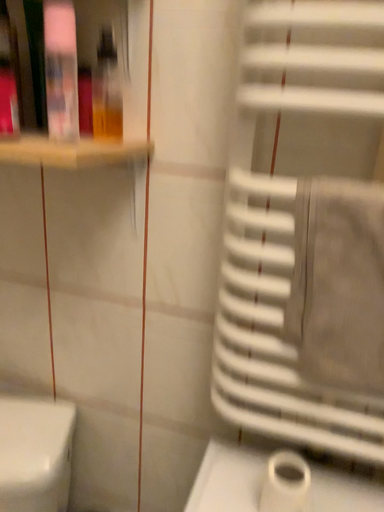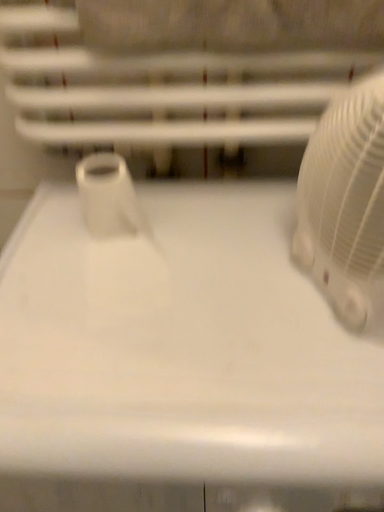
Question: How did the camera likely rotate when shooting the video?

Choices:
 (A) rotated upward
 (B) rotated downward

Answer: (B)